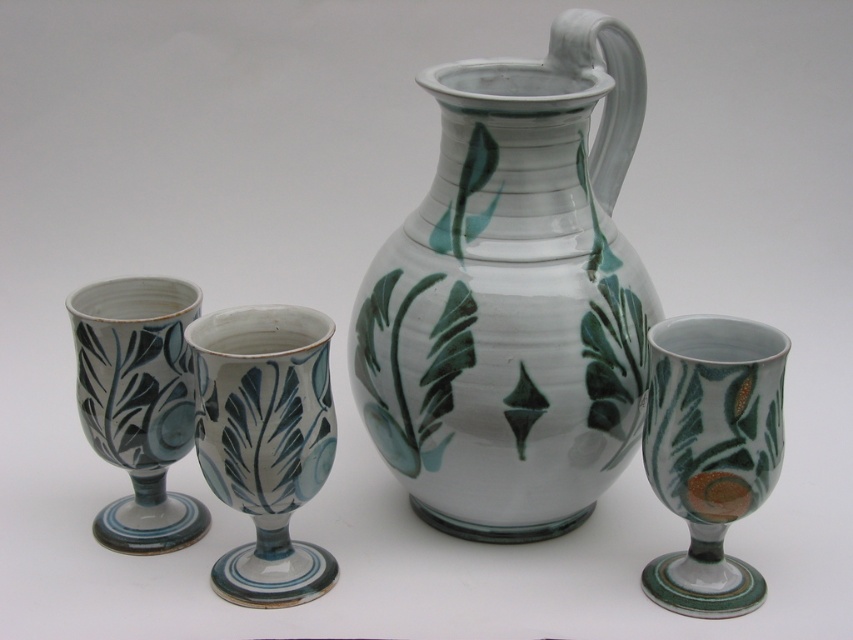
What do you see at coordinates (265, 442) in the screenshot?
I see `matte ceramic vase at center` at bounding box center [265, 442].

Based on the photo, between matte ceramic vase at center and matte ceramic goblet at right, which one has more height?

matte ceramic vase at center

Locate an element on the screen. The width and height of the screenshot is (853, 640). matte ceramic vase at center is located at coordinates (265, 442).

Does matte ceramic goblet at right come behind matte ceramic goblet at left?

No, it is not.

Is matte ceramic goblet at right bigger than matte ceramic goblet at left?

No, matte ceramic goblet at right is not bigger than matte ceramic goblet at left.

Image resolution: width=853 pixels, height=640 pixels. What do you see at coordinates (711, 452) in the screenshot?
I see `matte ceramic goblet at right` at bounding box center [711, 452].

Where is `matte ceramic goblet at right`? The image size is (853, 640). matte ceramic goblet at right is located at coordinates (711, 452).

Can you confirm if white glossy jug at center is thinner than matte ceramic goblet at right?

In fact, white glossy jug at center might be wider than matte ceramic goblet at right.

Which is below, white glossy jug at center or matte ceramic goblet at right?

matte ceramic goblet at right

Identify the location of white glossy jug at center. This screenshot has height=640, width=853. (514, 296).